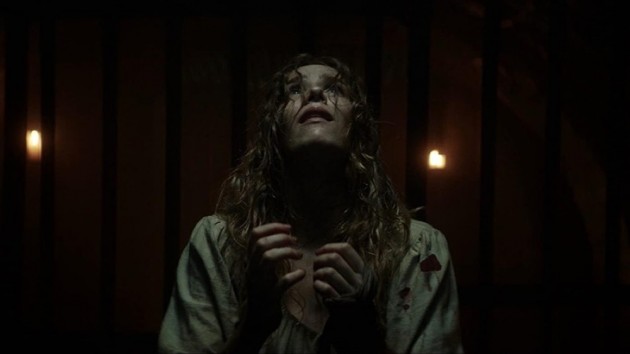
Image resolution: width=630 pixels, height=354 pixels. What are the coordinates of `area of wall illuminated by light` in the screenshot? It's located at (454, 142), (37, 120).